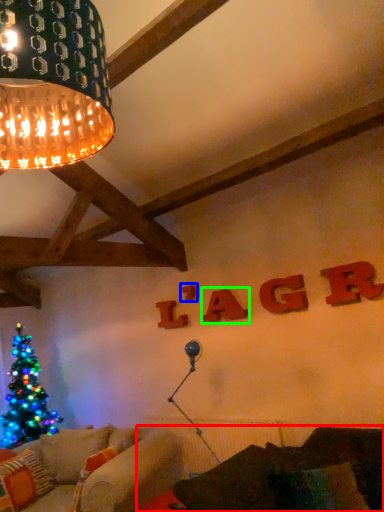
Question: Which is farther away from couch (highlighted by a red box)? letter (highlighted by a blue box) or letter (highlighted by a green box)?

Choices:
 (A) letter
 (B) letter

Answer: (A)